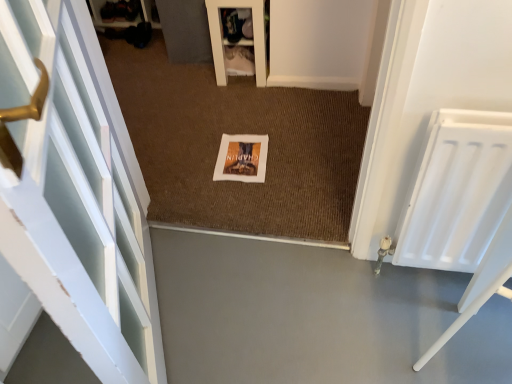
Where is `free region on the left part of white fabric shoe rack at upper center`? free region on the left part of white fabric shoe rack at upper center is located at coordinates (194, 76).